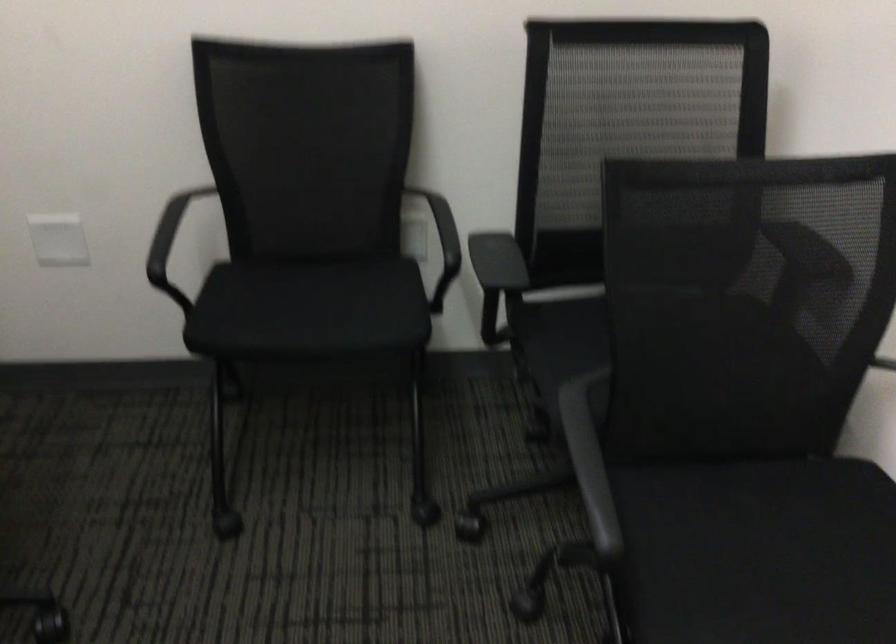
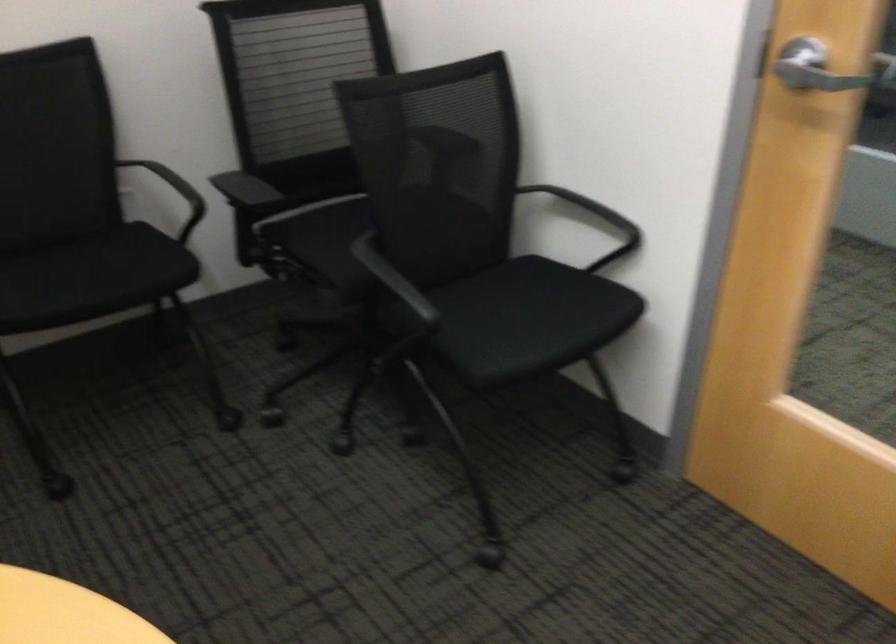
Find the pixel in the second image that matches the point at 597,459 in the first image.

(392, 278)